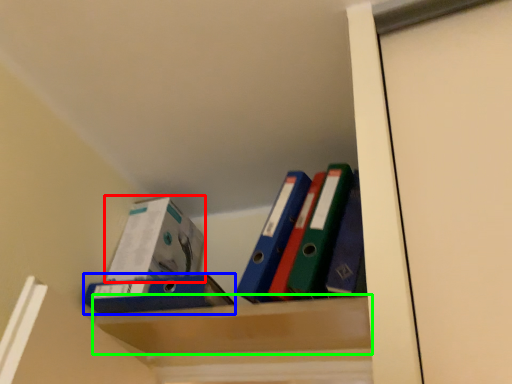
Question: Based on their relative distances, which object is farther from box (highlighted by a red box)? Choose from paperback book (highlighted by a blue box) and cabinet (highlighted by a green box).

Choices:
 (A) paperback book
 (B) cabinet

Answer: (B)